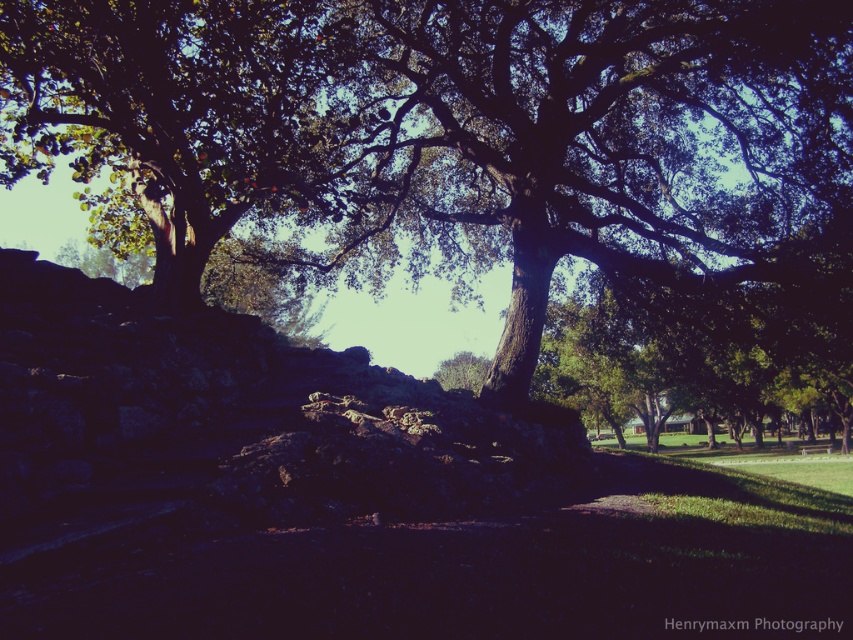
You are standing at point (601, 141) in the scene. What do you see directly in front of you?

At point (601, 141) lies green leafy tree at center.

You are standing in the middle of the scene and want to take a photo of both the green leafy tree at center and the green leafy tree at upper left. Which tree should you position closer to the camera to include both in the frame without one blocking the other?

To include both the green leafy tree at center and the green leafy tree at upper left in the frame without one blocking the other, you should position the green leafy tree at center closer to the camera since the green leafy tree at upper left is behind it.

You are planning to set up a picnic blanket in the area between the green leafy tree at center and the green leafy tree at upper left. Which tree has a larger canopy width to provide more shade?

The green leafy tree at center might have a wider canopy than the green leafy tree at upper left, so it could provide more shade for the picnic blanket.